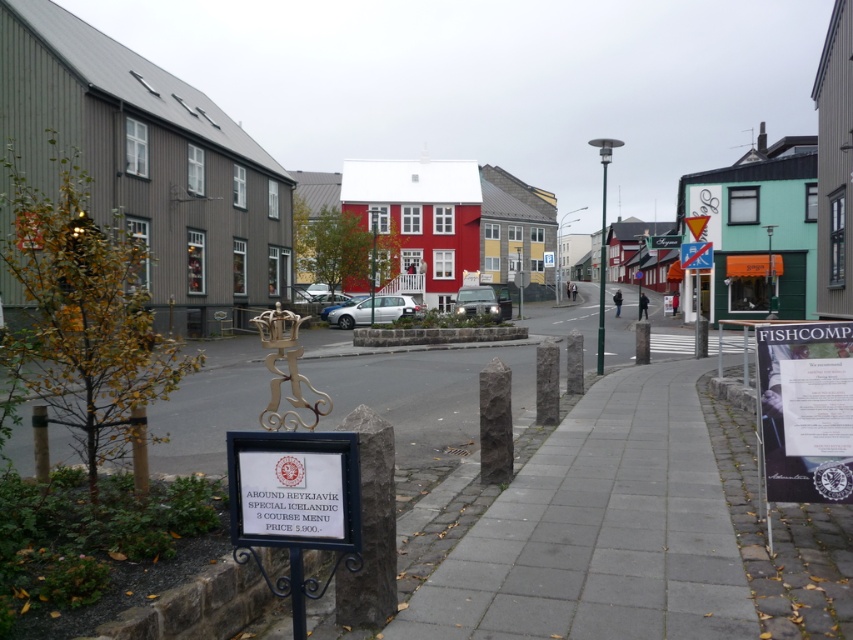
In the scene shown: Can you confirm if wooden signpost at center is taller than white plastic sign at center?

Indeed, wooden signpost at center has a greater height compared to white plastic sign at center.

Does wooden signpost at center appear under white plastic sign at center?

No, wooden signpost at center is not below white plastic sign at center.

This screenshot has height=640, width=853. In order to click on wooden signpost at center in this screenshot , I will do `click(463, 81)`.

Locate an element on the screen. wooden signpost at center is located at coordinates (463, 81).